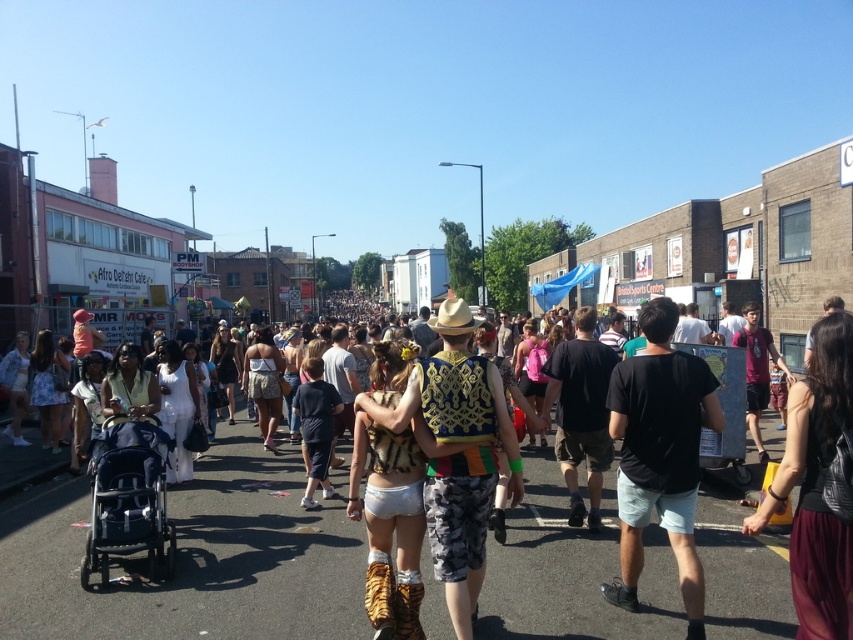
Question: Which point is closer to the camera?

Choices:
 (A) black leather purse at lower right
 (B) black matte t-shirt at center

Answer: (A)

Question: Is black matte t-shirt at center wider than black leather purse at lower right?

Choices:
 (A) yes
 (B) no

Answer: (A)

Question: Which point appears closest to the camera in this image?

Choices:
 (A) (148, 561)
 (B) (445, 305)

Answer: (B)

Question: Considering the real-world distances, which object is farthest from the beige straw cowboy hat at center?

Choices:
 (A) dark gray fabric baby carriage at lower left
 (B) black leather purse at lower right
 (C) black matte t-shirt at center

Answer: (A)

Question: Does black matte t-shirt at center have a larger size compared to dark gray fabric baby carriage at lower left?

Choices:
 (A) no
 (B) yes

Answer: (A)

Question: Does dark gray fabric baby carriage at lower left appear under beige straw cowboy hat at center?

Choices:
 (A) yes
 (B) no

Answer: (A)